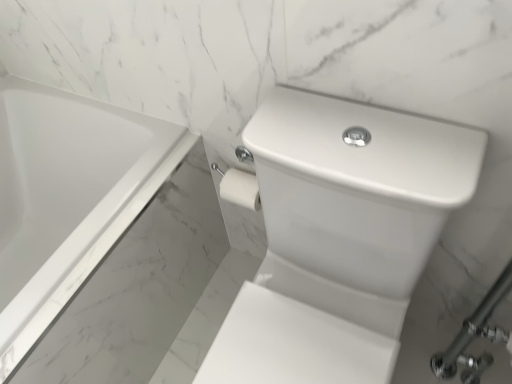
Describe the element at coordinates (339, 237) in the screenshot. This screenshot has width=512, height=384. I see `white glossy sink at center` at that location.

You are a GUI agent. You are given a task and a screenshot of the screen. Output one action in this format:
    pyautogui.click(x=<x>, y=<y>)
    Task: Click on the white glossy sink at center
    This screenshot has height=384, width=512.
    Given the screenshot: What is the action you would take?
    pyautogui.click(x=339, y=237)

What is the approximate width of white glossy sink at center?

25.23 inches.

This screenshot has height=384, width=512. Describe the element at coordinates (67, 197) in the screenshot. I see `white glossy bathtub at upper left` at that location.

Locate an element on the screen. white glossy bathtub at upper left is located at coordinates (67, 197).

You are a GUI agent. You are given a task and a screenshot of the screen. Output one action in this format:
    pyautogui.click(x=<x>, y=<y>)
    Task: Click on the white glossy sink at center
    
    Given the screenshot: What is the action you would take?
    pyautogui.click(x=339, y=237)

Visually, is white glossy sink at center positioned to the left or to the right of white glossy bathtub at upper left?

Clearly, white glossy sink at center is on the right of white glossy bathtub at upper left in the image.

Considering the positions of objects white glossy sink at center and white glossy bathtub at upper left in the image provided, who is in front, white glossy sink at center or white glossy bathtub at upper left?

white glossy sink at center.

Which point is more forward, (x=439, y=164) or (x=65, y=283)?

The point (x=439, y=164) is more forward.

From the image's perspective, is white glossy sink at center located above or below white glossy bathtub at upper left?

Based on their image positions, white glossy sink at center is located beneath white glossy bathtub at upper left.

Based on the photo, from a real-world perspective, does white glossy sink at center stand above white glossy bathtub at upper left?

Correct, in the physical world, white glossy sink at center is higher than white glossy bathtub at upper left.

Is white glossy sink at center thinner than white glossy bathtub at upper left?

Correct, the width of white glossy sink at center is less than that of white glossy bathtub at upper left.

Is white glossy sink at center taller than white glossy bathtub at upper left?

Correct, white glossy sink at center is much taller as white glossy bathtub at upper left.

Between white glossy sink at center and white glossy bathtub at upper left, which one has larger size?

With larger size is white glossy bathtub at upper left.

Is white glossy sink at center inside or outside of white glossy bathtub at upper left?

white glossy sink at center exists outside the volume of white glossy bathtub at upper left.

Is the surface of white glossy sink at center in direct contact with white glossy bathtub at upper left?

white glossy sink at center is not next to white glossy bathtub at upper left, and they're not touching.

Is white glossy sink at center aimed at white glossy bathtub at upper left?

No.

Looking at this image, measure the distance between white glossy sink at center and white glossy bathtub at upper left.

white glossy sink at center is 20.79 inches away from white glossy bathtub at upper left.

Locate an element on the screen. The height and width of the screenshot is (384, 512). sink located below the white glossy bathtub at upper left (from the image's perspective) is located at coordinates (339, 237).

In the image, is white glossy bathtub at upper left on the left side or the right side of white glossy sink at center?

Based on their positions, white glossy bathtub at upper left is located to the left of white glossy sink at center.

Which object is further away from the camera, white glossy bathtub at upper left or white glossy sink at center?

white glossy bathtub at upper left is more distant.

Is point (132, 164) closer to camera compared to point (444, 177)?

No, it is behind (444, 177).

From the image's perspective, is white glossy bathtub at upper left over white glossy sink at center?

Yes, from the image's perspective, white glossy bathtub at upper left is over white glossy sink at center.

From a real-world perspective, is white glossy bathtub at upper left below white glossy sink at center?

Yes, from a real-world perspective, white glossy bathtub at upper left is under white glossy sink at center.

Considering the sizes of objects white glossy bathtub at upper left and white glossy sink at center in the image provided, who is thinner, white glossy bathtub at upper left or white glossy sink at center?

Thinner between the two is white glossy sink at center.

Is white glossy bathtub at upper left taller than white glossy sink at center?

No.

Based on the photo, does white glossy bathtub at upper left have a larger size compared to white glossy sink at center?

Yes, white glossy bathtub at upper left is bigger than white glossy sink at center.

From the picture: Can we say white glossy bathtub at upper left lies outside white glossy sink at center?

Yes.

Are white glossy bathtub at upper left and white glossy sink at center far apart?

They are positioned close to each other.

Is white glossy bathtub at upper left facing away from white glossy sink at center?

Result: That's not correct — white glossy bathtub at upper left is not looking away from white glossy sink at center.

What's the angular difference between white glossy bathtub at upper left and white glossy sink at center's facing directions?

90.1 degrees separate the facing orientations of white glossy bathtub at upper left and white glossy sink at center.

How distant is white glossy bathtub at upper left from white glossy sink at center?

white glossy bathtub at upper left is 20.79 inches away from white glossy sink at center.

Find the location of a particular element. This screenshot has width=512, height=384. sink that appears in front of the white glossy bathtub at upper left is located at coordinates (339, 237).

Where is `sink above the white glossy bathtub at upper left (from a real-world perspective)`? sink above the white glossy bathtub at upper left (from a real-world perspective) is located at coordinates (339, 237).

Find the location of `sink that is below the white glossy bathtub at upper left (from the image's perspective)`. sink that is below the white glossy bathtub at upper left (from the image's perspective) is located at coordinates (339, 237).